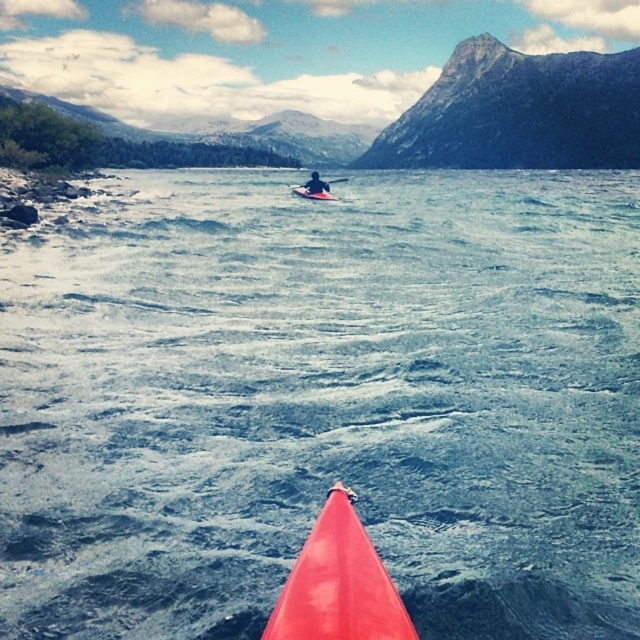
Question: Which of the following is the farthest from the observer?

Choices:
 (A) (467, 120)
 (B) (292, 188)
 (C) (637, 342)
 (D) (314, 556)

Answer: (A)

Question: Which of the following is the closest to the observer?

Choices:
 (A) pyautogui.click(x=324, y=196)
 (B) pyautogui.click(x=332, y=602)
 (C) pyautogui.click(x=600, y=204)
 (D) pyautogui.click(x=344, y=179)

Answer: (B)

Question: Can you confirm if blue water at center is positioned to the left of shiny red kayak at center?

Choices:
 (A) yes
 (B) no

Answer: (B)

Question: Does shiny red kayak at center have a smaller size compared to matte red kayak at center?

Choices:
 (A) no
 (B) yes

Answer: (B)

Question: Among these points, which one is farthest from the camera?

Choices:
 (A) (621, 58)
 (B) (328, 628)
 (C) (324, 196)

Answer: (A)

Question: Can you confirm if orange plastic canoe at center is positioned to the right of matte red kayak at center?

Choices:
 (A) yes
 (B) no

Answer: (B)